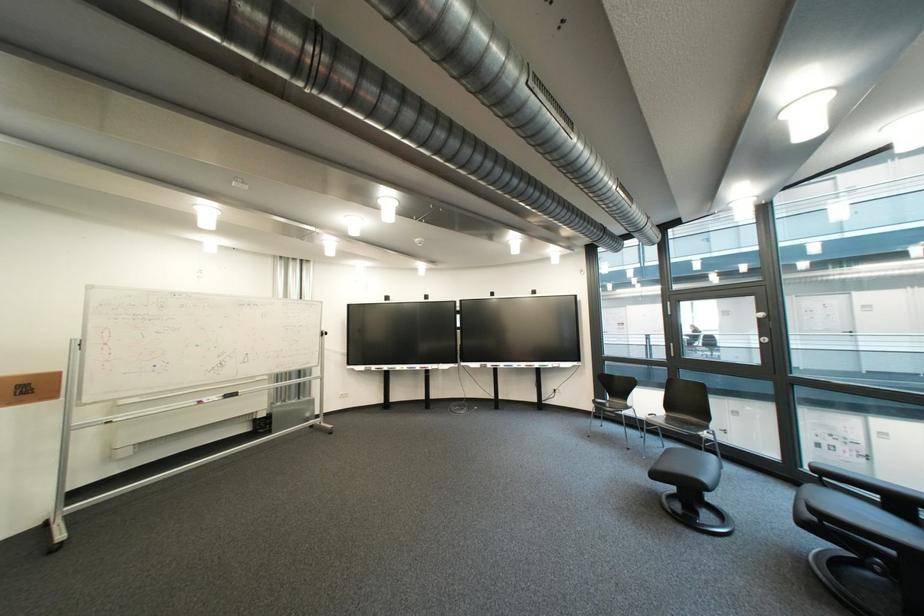
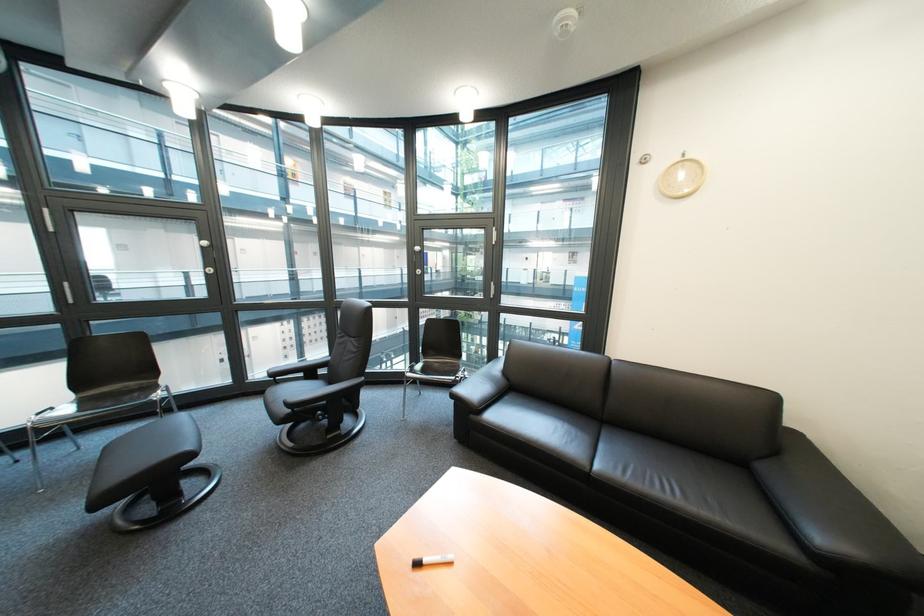
In the second image, find the point that corresponds to the point at 834,480 in the first image.

(287, 381)